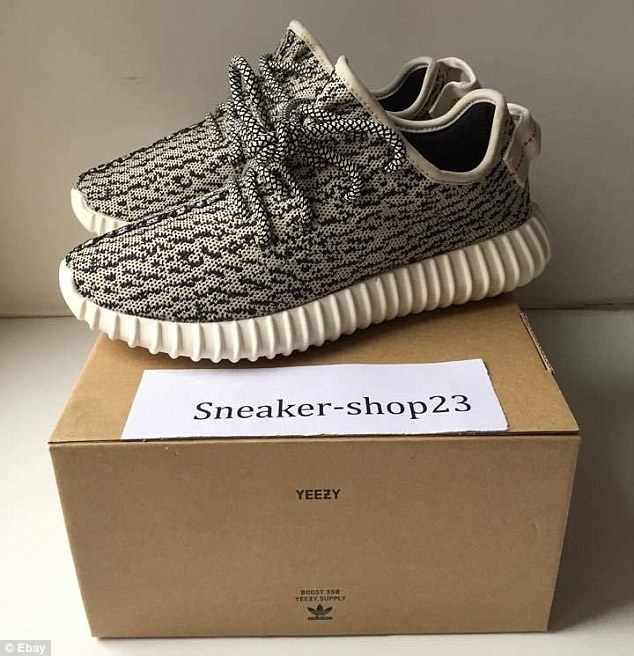
The image size is (634, 656). Find the location of `white trim`. white trim is located at coordinates (493, 127), (415, 126).